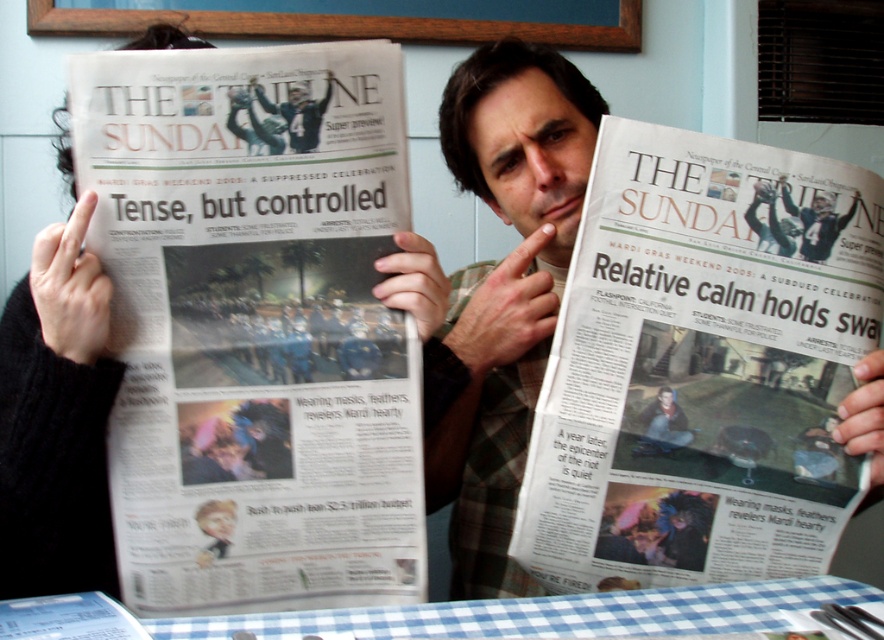
Is point (667, 572) closer to camera compared to point (783, 177)?

No, (667, 572) is further to viewer.

Does point (772, 179) come farther from viewer compared to point (814, 220)?

No.

You are a GUI agent. You are given a task and a screenshot of the screen. Output one action in this format:
    pyautogui.click(x=<x>, y=<y>)
    Task: Click on the white paper newspaper at center
    
    Given the screenshot: What is the action you would take?
    pyautogui.click(x=699, y=368)

Does point (351, 202) lie in front of point (832, 196)?

Yes, point (351, 202) is closer to viewer.

Find the location of a particular element. The image size is (884, 640). white paper newspaper at left is located at coordinates (255, 324).

Does white paper newspaper at center have a larger size compared to blue checkered tablecloth at lower center?

Correct, white paper newspaper at center is larger in size than blue checkered tablecloth at lower center.

Between point (844, 189) and point (370, 636), which one is positioned behind?

The point (844, 189) is more distant.

Is point (625, 138) positioned in front of point (509, 612)?

No, it is behind (509, 612).

Image resolution: width=884 pixels, height=640 pixels. I want to click on white paper newspaper at center, so click(x=699, y=368).